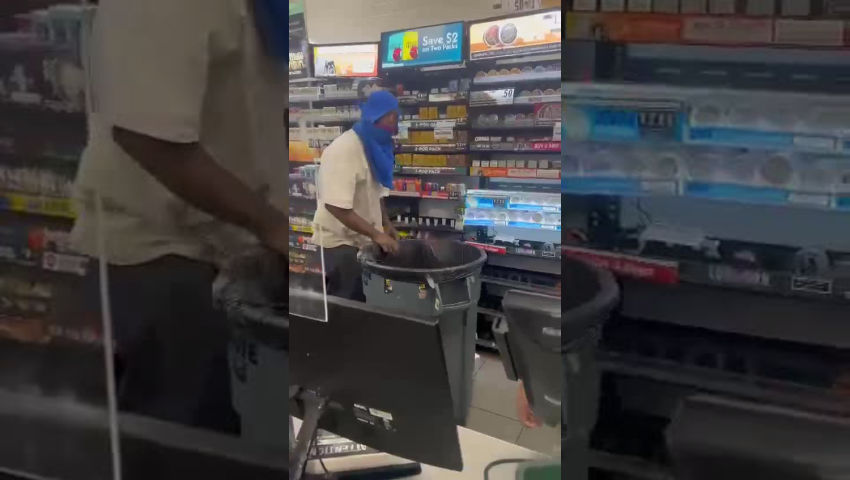
Identify the location of counter top in store. The image size is (850, 480). (476, 450).